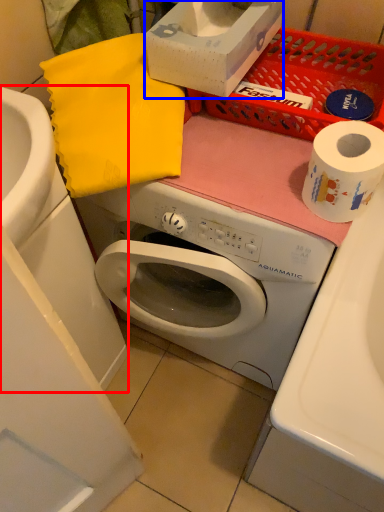
Question: Among these objects, which one is nearest to the camera, sink (highlighted by a red box) or box (highlighted by a blue box)?

Choices:
 (A) sink
 (B) box

Answer: (A)